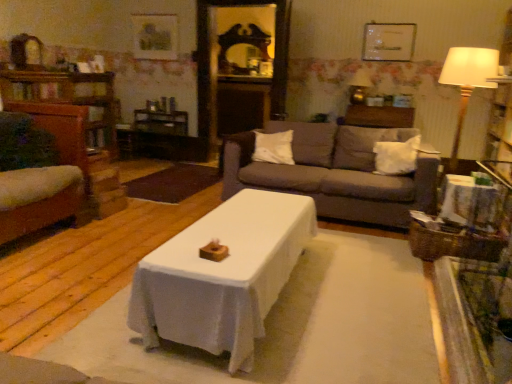
What is the approximate width of matte white picture frame at upper center, the 2th picture frame when ordered from left to right?

matte white picture frame at upper center, the 2th picture frame when ordered from left to right, is 2.02 inches wide.

Describe the element at coordinates (467, 201) in the screenshot. I see `wooden side table at right` at that location.

Locate an element on the screen. The width and height of the screenshot is (512, 384). wooden mirror at upper center is located at coordinates (245, 51).

What do you see at coordinates (396, 156) in the screenshot? I see `white soft pillow at center, the second pillow positioned from the left` at bounding box center [396, 156].

The height and width of the screenshot is (384, 512). Find the location of `dark gray fabric couch at center`. dark gray fabric couch at center is located at coordinates (335, 172).

In order to face wooden picture frame at upper center, acting as the second picture frame starting from the front, should I rotate leftwards or rightwards?

You should rotate left by 13.301 degrees.

Identify the location of wooden dresser at left. This screenshot has height=384, width=512. (67, 95).

Can you tell me how much white soft pillow at center, the second pillow positioned from the left, and wooden mirror at upper center differ in facing direction?

white soft pillow at center, the second pillow positioned from the left, and wooden mirror at upper center are facing 2.34 degrees away from each other.

From a real-world perspective, is white soft pillow at center, positioned as the 1th pillow in right-to-left order, physically below wooden mirror at upper center?

Yes, from a real-world perspective, white soft pillow at center, positioned as the 1th pillow in right-to-left order, is beneath wooden mirror at upper center.

Between white soft pillow at center, positioned as the 1th pillow in right-to-left order, and wooden mirror at upper center, which one has less height?

Standing shorter between the two is white soft pillow at center, positioned as the 1th pillow in right-to-left order.

Could you tell me if white soft pillow at center, positioned as the 1th pillow in right-to-left order, is facing wooden mirror at upper center?

No, white soft pillow at center, positioned as the 1th pillow in right-to-left order, is not turned towards wooden mirror at upper center.

From a real-world perspective, is matte white picture frame at upper center, which ranks as the 1th picture frame in right-to-left order, located higher than wooden picture frame at upper center, the first picture frame in the back-to-front sequence?

No.

Who is more distant, matte white picture frame at upper center, the 2th picture frame when ordered from left to right, or wooden picture frame at upper center, acting as the second picture frame starting from the front?

wooden picture frame at upper center, acting as the second picture frame starting from the front, is more distant.

Can you tell me how much matte white picture frame at upper center, the 2th picture frame when ordered from left to right, and wooden picture frame at upper center, positioned as the 2th picture frame in right-to-left order, differ in facing direction?

The angle between the facing direction of matte white picture frame at upper center, the 2th picture frame when ordered from left to right, and the facing direction of wooden picture frame at upper center, positioned as the 2th picture frame in right-to-left order, is 0.122 degrees.

Is matte white picture frame at upper center, which ranks as the 1th picture frame in right-to-left order, positioned with its back to wooden picture frame at upper center, positioned as the 2th picture frame in right-to-left order?

matte white picture frame at upper center, which ranks as the 1th picture frame in right-to-left order, is not turned away from wooden picture frame at upper center, positioned as the 2th picture frame in right-to-left order.

Which is more to the left, dark gray fabric couch at center or wooden dresser at left?

Positioned to the left is wooden dresser at left.

From the picture: Can we say dark gray fabric couch at center lies outside wooden dresser at left?

Indeed, dark gray fabric couch at center is completely outside wooden dresser at left.

From the picture: From the image's perspective, between dark gray fabric couch at center and wooden dresser at left, which one is located above?

From the image's view, wooden dresser at left is above.

The height and width of the screenshot is (384, 512). There is a dark gray fabric couch at center. In order to click on dresser above it (from a real-world perspective) in this screenshot , I will do 67,95.

From a real-world perspective, which object stands above the other?

wooden mirror at upper center, from a real-world perspective.

Which object is further away from the camera, wooden mirror at upper center or white soft pillow at center, which is the second pillow from right to left?

wooden mirror at upper center is further from the camera.

Is wooden mirror at upper center surrounding white soft pillow at center, which is the second pillow from right to left?

That's incorrect, white soft pillow at center, which is the second pillow from right to left, is not inside wooden mirror at upper center.

Can you confirm if matte white picture frame at upper center, which is counted as the first picture frame, starting from the front, is taller than white soft pillow at center, which ranks as the first pillow in left-to-right order?

Yes.

From a real-world perspective, count 1st pillows downward from the matte white picture frame at upper center, the 2th picture frame when ordered from left to right, and point to it. Please provide its 2D coordinates.

[(274, 147)]

Are matte white picture frame at upper center, which ranks as the 1th picture frame in right-to-left order, and white soft pillow at center, which ranks as the first pillow in left-to-right order, far apart?

matte white picture frame at upper center, which ranks as the 1th picture frame in right-to-left order, is far away from white soft pillow at center, which ranks as the first pillow in left-to-right order.

Looking at the image, does matte white picture frame at upper center, which is counted as the first picture frame, starting from the front, seem bigger or smaller compared to white soft pillow at center, which is the second pillow from right to left?

In the image, matte white picture frame at upper center, which is counted as the first picture frame, starting from the front, appears to be smaller than white soft pillow at center, which is the second pillow from right to left.

From a real-world perspective, relative to matte white picture frame at upper center, which ranks as the 1th picture frame in right-to-left order, is wooden picture frame at upper center, positioned as the 2th picture frame in right-to-left order, vertically above or below?

Clearly, from a real-world perspective, wooden picture frame at upper center, positioned as the 2th picture frame in right-to-left order, is above matte white picture frame at upper center, which ranks as the 1th picture frame in right-to-left order.

From their relative heights in the image, would you say wooden picture frame at upper center, the first picture frame in the back-to-front sequence, is taller or shorter than matte white picture frame at upper center, the 2th picture frame when ordered from left to right?

Clearly, wooden picture frame at upper center, the first picture frame in the back-to-front sequence, is taller compared to matte white picture frame at upper center, the 2th picture frame when ordered from left to right.

Considering the positions of objects wooden picture frame at upper center, positioned as the 2th picture frame in right-to-left order, and matte white picture frame at upper center, which ranks as the 1th picture frame in right-to-left order, in the image provided, who is more to the left, wooden picture frame at upper center, positioned as the 2th picture frame in right-to-left order, or matte white picture frame at upper center, which ranks as the 1th picture frame in right-to-left order,?

From the viewer's perspective, wooden picture frame at upper center, positioned as the 2th picture frame in right-to-left order, appears more on the left side.

How distant is wooden picture frame at upper center, positioned as the 2th picture frame in right-to-left order, from matte white picture frame at upper center, which ranks as the 1th picture frame in right-to-left order?

A distance of 9.37 feet exists between wooden picture frame at upper center, positioned as the 2th picture frame in right-to-left order, and matte white picture frame at upper center, which ranks as the 1th picture frame in right-to-left order.

Is wooden picture frame at upper center, positioned as the 2th picture frame in right-to-left order, inside wooden mirror at upper center?

No, wooden picture frame at upper center, positioned as the 2th picture frame in right-to-left order, is not surrounded by wooden mirror at upper center.

Is wooden mirror at upper center to the left of wooden picture frame at upper center, the first picture frame in the back-to-front sequence, from the viewer's perspective?

No.

Does wooden mirror at upper center have a lesser width compared to wooden picture frame at upper center, acting as the second picture frame starting from the front?

No.

Locate an element on the screen. The height and width of the screenshot is (384, 512). the 2nd pillow directly beneath the wooden mirror at upper center (from a real-world perspective) is located at coordinates (396, 156).

The width and height of the screenshot is (512, 384). Find the location of `picture frame above the matte white picture frame at upper center, which is counted as the first picture frame, starting from the front (from a real-world perspective)`. picture frame above the matte white picture frame at upper center, which is counted as the first picture frame, starting from the front (from a real-world perspective) is located at coordinates (155, 36).

Which object lies nearer to the anchor point wooden dresser at left, wooden swivel chair at left or wooden mirror at upper center?

wooden mirror at upper center is positioned closer to the anchor wooden dresser at left.

Which object lies further to the anchor point dark gray fabric couch at center, wooden swivel chair at left or matte gold lamp at upper right?

matte gold lamp at upper right is further to dark gray fabric couch at center.

Based on the photo, looking at the image, which one is located further to wooden side table at right, white soft pillow at center, positioned as the 1th pillow in right-to-left order, or dark gray fabric couch at center?

white soft pillow at center, positioned as the 1th pillow in right-to-left order, is positioned further to the anchor wooden side table at right.

Which object lies further to the anchor point wooden mirror at upper center, wooden side table at right or matte white picture frame at upper center, the 2th picture frame when ordered from left to right?

Based on the image, wooden side table at right appears to be further to wooden mirror at upper center.

Looking at the image, which one is located further to wooden side table at right, white soft pillow at center, which is the second pillow from right to left, or dark gray fabric couch at center?

white soft pillow at center, which is the second pillow from right to left, is further to wooden side table at right.

Estimate the real-world distances between objects in this image. Which object is further from wooden picture frame at upper center, positioned as the 2th picture frame in right-to-left order, white soft pillow at center, the second pillow positioned from the left, or dark gray fabric couch at center?

The object further to wooden picture frame at upper center, positioned as the 2th picture frame in right-to-left order, is white soft pillow at center, the second pillow positioned from the left.

Considering their positions, is matte white picture frame at upper center, which is counted as the first picture frame, starting from the front, positioned closer to wooden dresser at left than wooden swivel chair at left?

Based on the image, wooden swivel chair at left appears to be nearer to wooden dresser at left.

Estimate the real-world distances between objects in this image. Which object is further from wooden picture frame at upper center, placed as the 1th picture frame when sorted from left to right, matte white picture frame at upper center, the 2th picture frame when ordered from back to front, or wooden side table at right?

Among the two, wooden side table at right is located further to wooden picture frame at upper center, placed as the 1th picture frame when sorted from left to right.

The height and width of the screenshot is (384, 512). I want to click on picture frame between wooden dresser at left and dark gray fabric couch at center, so click(x=155, y=36).

Identify the location of lamp between wooden dresser at left and wooden mirror at upper center in the front-back direction. (359, 86).

Locate an element on the screen. The width and height of the screenshot is (512, 384). studio couch positioned between wooden side table at right and matte white picture frame at upper center, which ranks as the 1th picture frame in right-to-left order, from near to far is located at coordinates point(335,172).

Where is `studio couch between wooden picture frame at upper center, placed as the 1th picture frame when sorted from left to right, and matte gold lamp at upper right, in the horizontal direction`? The height and width of the screenshot is (384, 512). studio couch between wooden picture frame at upper center, placed as the 1th picture frame when sorted from left to right, and matte gold lamp at upper right, in the horizontal direction is located at coordinates (335, 172).